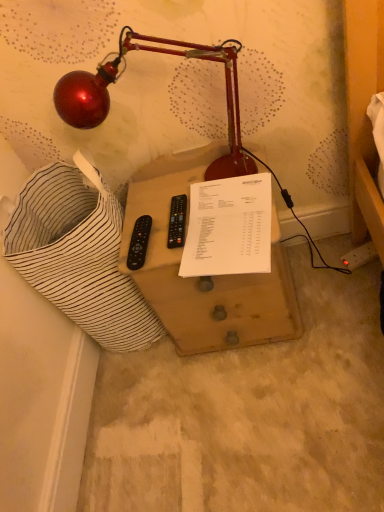
Locate an element on the screen. The image size is (384, 512). free space that is in between black plastic remote at center, acting as the second control starting from the left, and black plastic remote at center-left, arranged as the second control when viewed from the right is located at coordinates (159, 236).